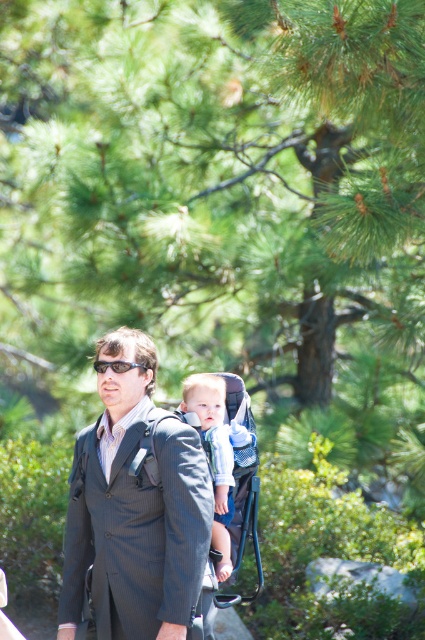
You are a photographer observing a man in a dark gray suit at center and a light blue denim shirt at center. Which clothing item is closer to you?

The dark gray suit at center is closer to you because it is in front of the light blue denim shirt at center.

You are a fashion designer observing the man in the image. You need to determine if his light blue denim shirt at center can fit into a storage box designed for items smaller than the black plastic sunglasses at center. Can it fit?

The light blue denim shirt at center has a larger width than the black plastic sunglasses at center, so it cannot fit into a storage box designed for items smaller than the black plastic sunglasses at center.

You are a photographer trying to capture the man in the dark gray suit at center. You want to position your camera so that the point at coordinates point (135,509) is within the frame. Is this possible?

Yes, because the point (135,509) is on the dark gray suit at center, so positioning the camera to include the center area will ensure the point is within the frame.